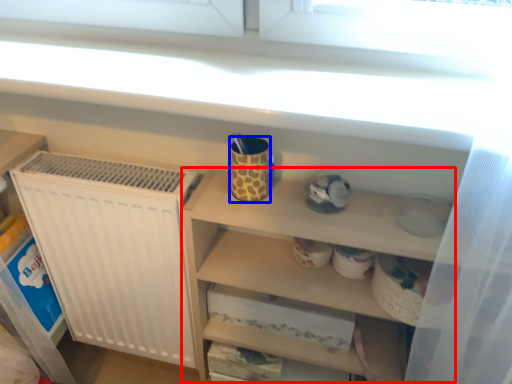
Question: Among these objects, which one is farthest to the camera, cabinet (highlighted by a red box) or mug (highlighted by a blue box)?

Choices:
 (A) cabinet
 (B) mug

Answer: (B)